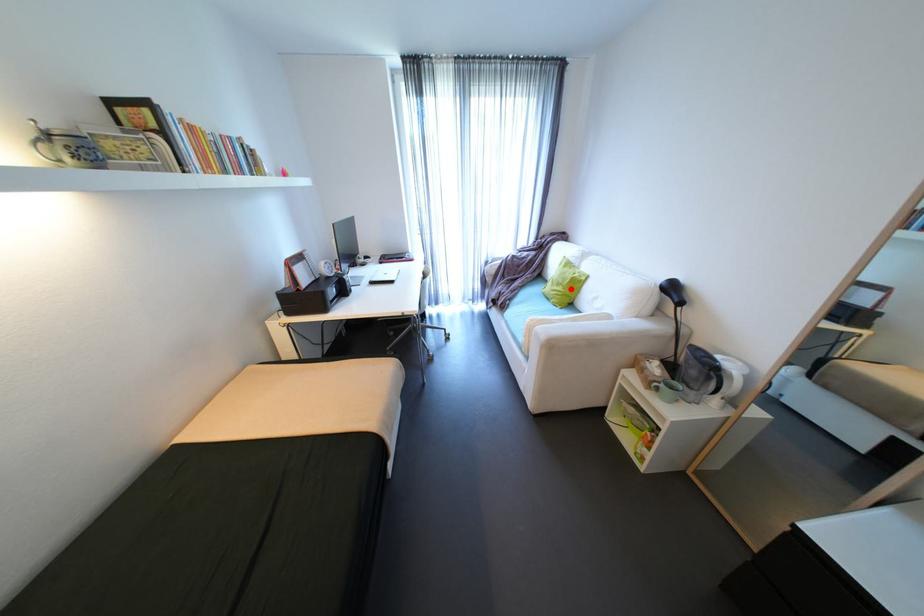
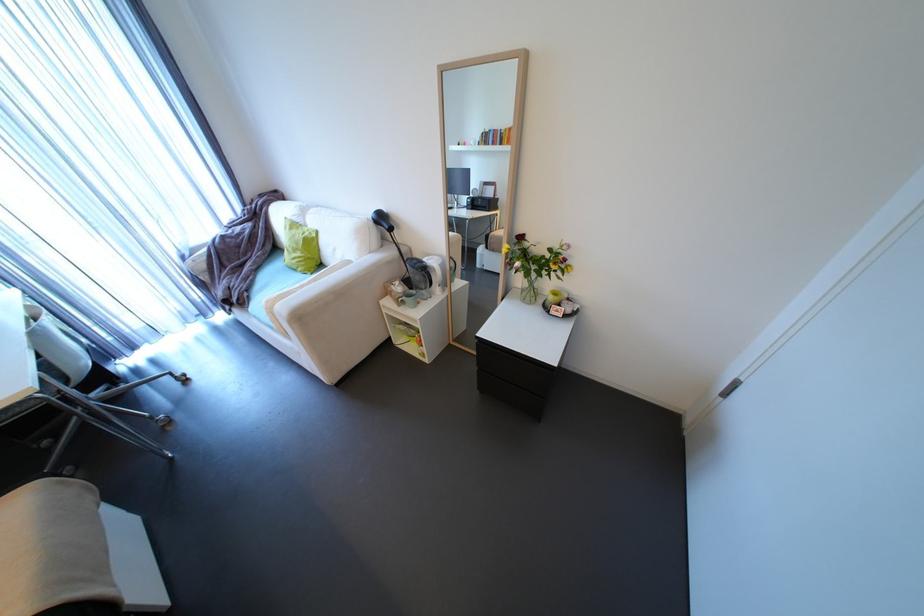
Find the pixel in the second image that matches the highlighted location in the first image.

(310, 253)